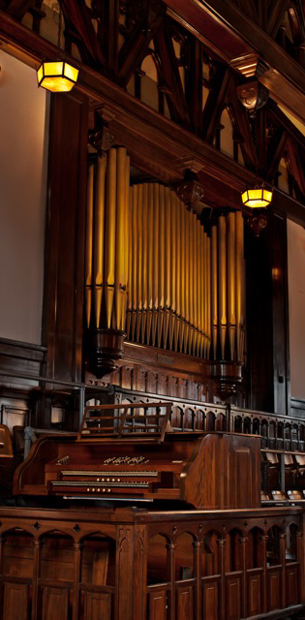
At what (x,y) coordinates should I click in order to perform the action: click on keys. Please return your answer as a coordinate pair (x, y). This screenshot has width=305, height=620. Looking at the image, I should click on (103, 485), (111, 470).